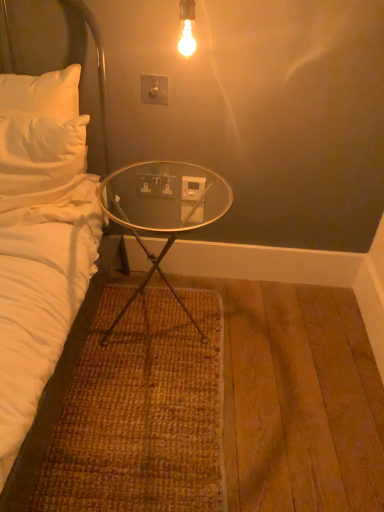
Question: From their relative heights in the image, would you say transparent glass table at center is taller or shorter than white plastic electric outlet at center, positioned as the 1th electric outlet in bottom-to-top order?

Choices:
 (A) short
 (B) tall

Answer: (B)

Question: From a real-world perspective, relative to white plastic electric outlet at center, which is the second electric outlet in front-to-back order, is transparent glass table at center vertically above or below?

Choices:
 (A) below
 (B) above

Answer: (A)

Question: Estimate the real-world distances between objects in this image. Which object is closer to the transparent glass table at center?

Choices:
 (A) white plastic switch at upper center, marked as the second electric outlet in a back-to-front arrangement
 (B) white soft bed at left
 (C) white plastic power outlet at center
 (D) white plastic electric outlet at center, which is the second electric outlet in front-to-back order

Answer: (D)

Question: Based on their relative distances, which object is farther from the white plastic power outlet at center?

Choices:
 (A) white plastic switch at upper center, placed as the 2th electric outlet when sorted from bottom to top
 (B) white soft bed at left
 (C) transparent glass table at center
 (D) white plastic electric outlet at center, positioned as the 1th electric outlet in bottom-to-top order

Answer: (B)